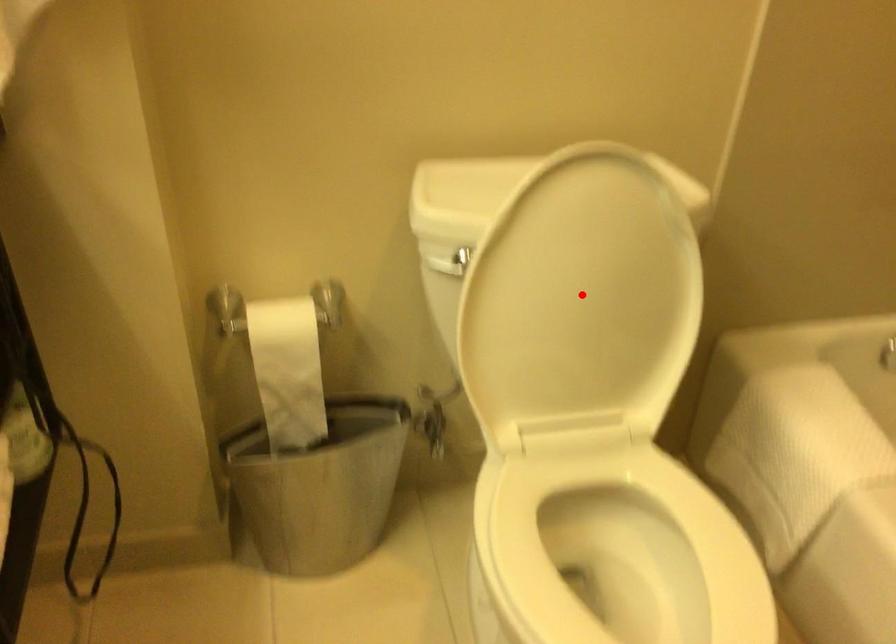
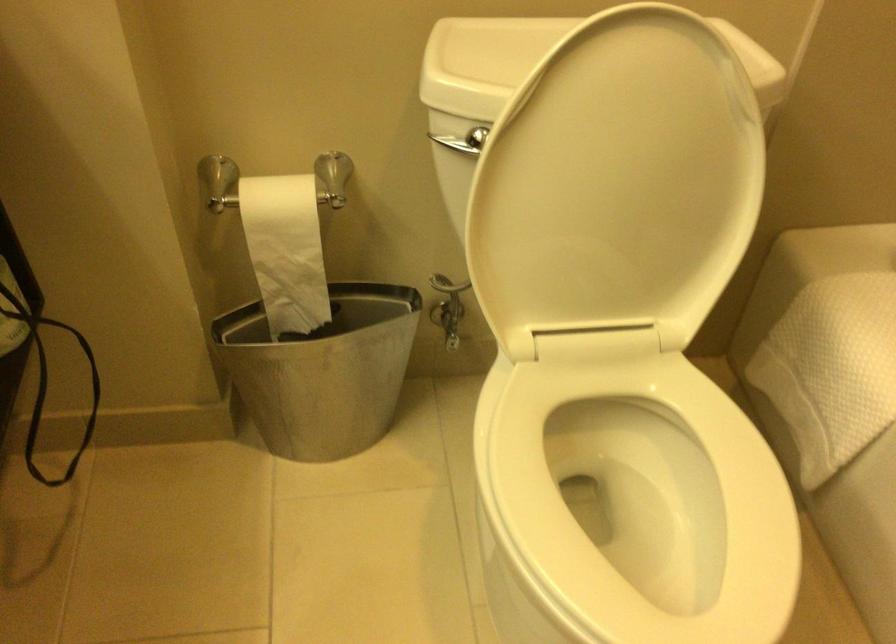
Question: I am providing you with two images of the same scene from different viewpoints. Given a red point in image1, look at the same physical point in image2. Is it:

Choices:
 (A) Closer to the viewpoint
 (B) Farther from the viewpoint

Answer: (A)